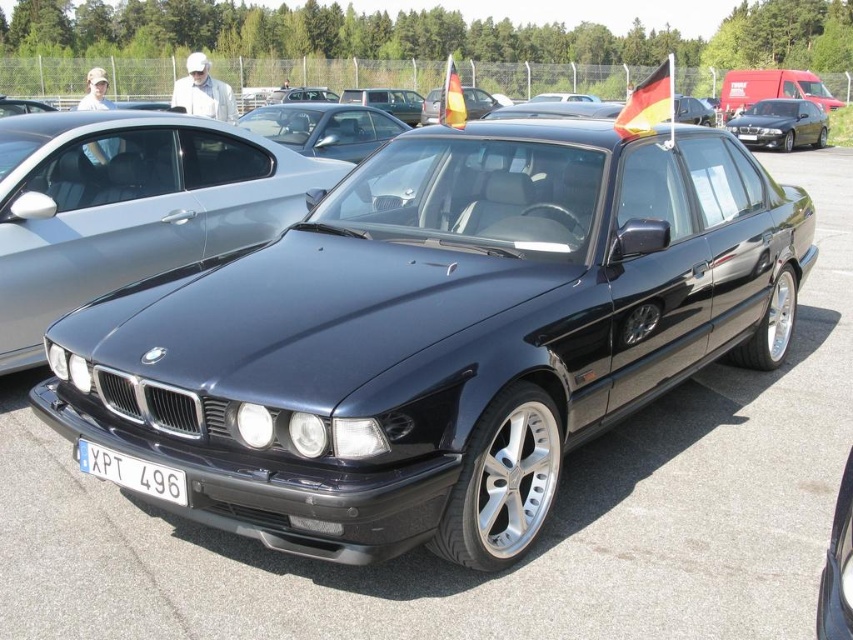
Is satin black sedan at center shorter than satin black car at center?

Incorrect, satin black sedan at center's height does not fall short of satin black car at center's.

Is point (653, 154) closer to camera compared to point (21, 253)?

That is True.

Locate an element on the screen. This screenshot has height=640, width=853. satin black sedan at center is located at coordinates (438, 333).

Between point (136, 216) and point (804, 129), which one is positioned in front?

Point (136, 216)

Is satin black car at center behind shiny black sedan at center?

No, satin black car at center is closer to the viewer.

Where is `satin black car at center`? satin black car at center is located at coordinates (128, 205).

Locate an element on the screen. This screenshot has height=640, width=853. satin black car at center is located at coordinates (128, 205).

Consider the image. Is satin black sedan at center shorter than white plastic license plate at lower center?

No.

Between point (503, 173) and point (117, 461), which one is positioned behind?

The point (503, 173) is behind.

Image resolution: width=853 pixels, height=640 pixels. Describe the element at coordinates (438, 333) in the screenshot. I see `satin black sedan at center` at that location.

Find the location of a particular element. The image size is (853, 640). satin black sedan at center is located at coordinates 438,333.